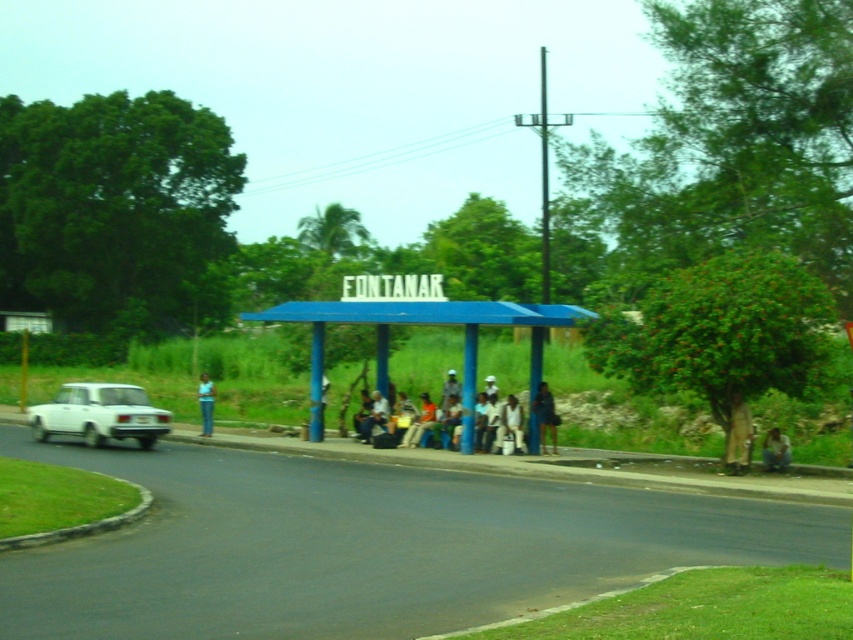
You are a delivery person trying to park your van next to the white matte car at left. The van is 2 meters tall. Can you park there without hitting the brown leather jacket at lower right?

The white matte car at left is shorter than the brown leather jacket at lower right. Since the van is 2 meters tall, you need to ensure there is enough vertical space. However, the description does not provide specific measurements for the jacket or the available height, so it is unclear if the van will hit the jacket. Check the actual height before parking.

You are standing at the bus stop shelter labeled FONTANAR. You see a point marked at coordinates [99,413]. Which object does this point belong to?

The point at coordinates [99,413] is on the white matte car at left.

You are a pedestrian standing at the bus stop shelter labeled FONTANAR. You need to cross the road to reach a store on the other side. Before stepping out, you notice the white matte car at left and the light brown fabric shirt at center. Which object takes up more space in the scene?

The light brown fabric shirt at center takes up more space in the scene than the white matte car at left because the white matte car at left occupies less space than light brown fabric shirt at center.